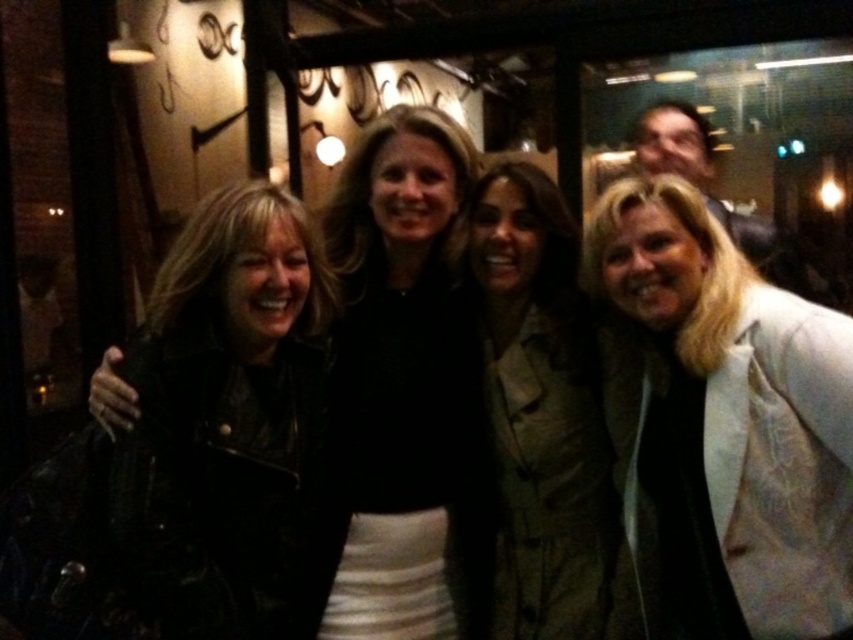
Question: Which is nearer to the white textured blazer at center?

Choices:
 (A) leather jacket at center
 (B) khaki fabric coat at center

Answer: (B)

Question: Can you confirm if white textured blazer at center is thinner than khaki fabric coat at center?

Choices:
 (A) yes
 (B) no

Answer: (B)

Question: Based on their relative distances, which object is nearer to the white textured blazer at center?

Choices:
 (A) leather jacket at center
 (B) khaki fabric coat at center

Answer: (B)

Question: Is white textured blazer at center above leather jacket at center?

Choices:
 (A) yes
 (B) no

Answer: (B)

Question: Is white textured blazer at center to the right of khaki fabric coat at center from the viewer's perspective?

Choices:
 (A) yes
 (B) no

Answer: (A)

Question: Which point appears farthest from the camera in this image?

Choices:
 (A) (576, 541)
 (B) (379, 417)

Answer: (A)